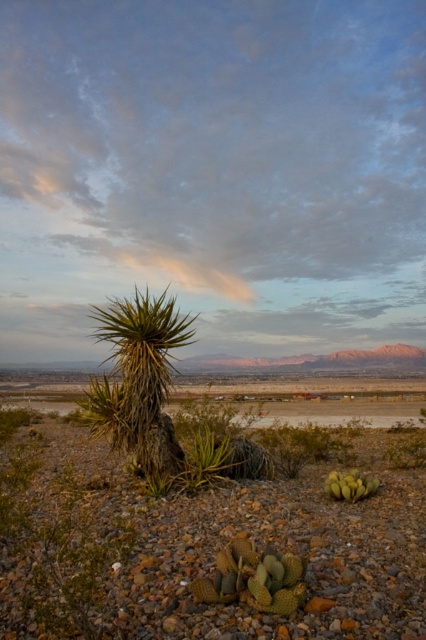
You are standing at the edge of the desert and see both the green spiky cactus at center and the green spiky cactus at lower right. Which cactus is positioned more to the east if the sun is setting in the west?

The green spiky cactus at center is positioned more to the east because it is to the left of the green spiky cactus at lower right, and since the sun is setting in the west, left would correspond to east.